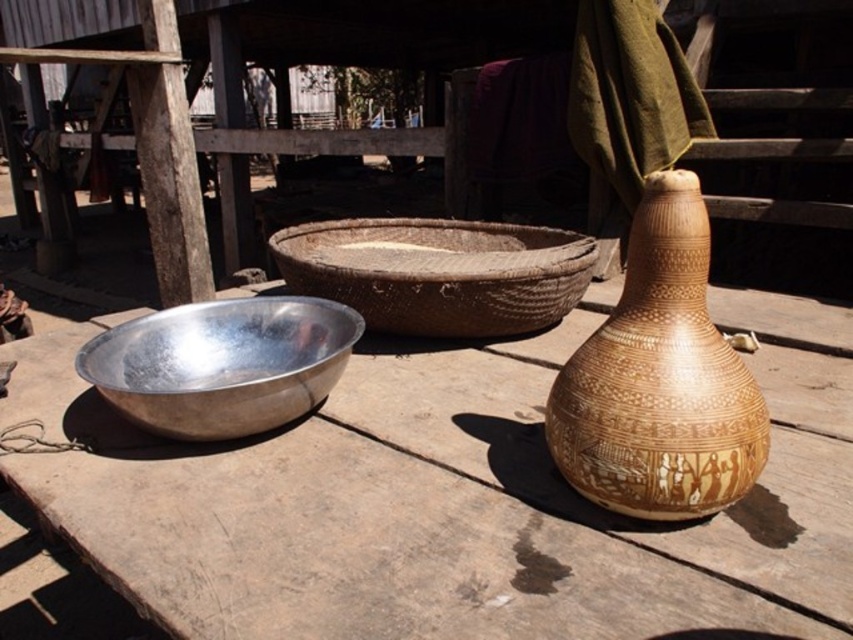
Can you confirm if metallic wood table at center is positioned to the right of silver metallic bowl at left?

Correct, you'll find metallic wood table at center to the right of silver metallic bowl at left.

Based on the photo, does metallic wood table at center appear under silver metallic bowl at left?

Indeed, metallic wood table at center is positioned under silver metallic bowl at left.

Does point (462, 493) come farther from viewer compared to point (178, 381)?

No, it is in front of (178, 381).

Locate an element on the screen. This screenshot has height=640, width=853. metallic wood table at center is located at coordinates (421, 516).

From the picture: Can you confirm if brown textured vase at right is positioned above woven brown basket at center?

Actually, brown textured vase at right is below woven brown basket at center.

Can you confirm if brown textured vase at right is positioned to the right of woven brown basket at center?

Yes, brown textured vase at right is to the right of woven brown basket at center.

Between point (654, 352) and point (483, 264), which one is positioned in front?

Point (654, 352) is more forward.

The height and width of the screenshot is (640, 853). Find the location of `brown textured vase at right`. brown textured vase at right is located at coordinates (659, 380).

Is woven brown basket at center above silver metallic bowl at left?

Yes.

In the scene shown: Is woven brown basket at center taller than silver metallic bowl at left?

Yes.

Does point (491, 284) come behind point (196, 308)?

Yes, it is.

This screenshot has width=853, height=640. Identify the location of woven brown basket at center. pos(438,273).